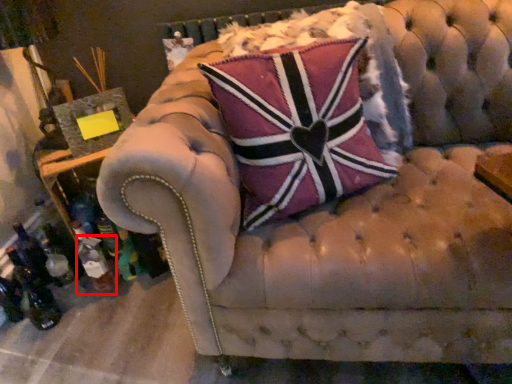
Question: Observing the image, what is the correct spatial positioning of bottle (annotated by the red box) in reference to pillow?

Choices:
 (A) right
 (B) left

Answer: (B)